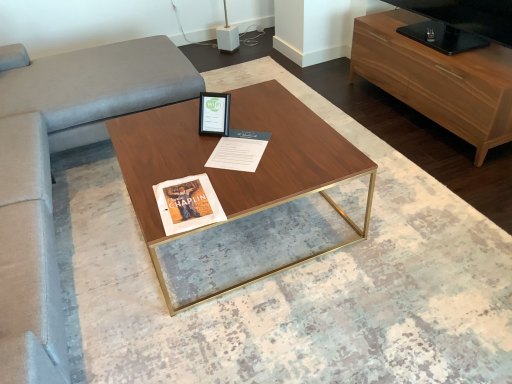
Where is `velvet couch at left`? This screenshot has height=384, width=512. velvet couch at left is located at coordinates (98, 87).

What do you see at coordinates (239, 150) in the screenshot?
I see `white paper at center` at bounding box center [239, 150].

The width and height of the screenshot is (512, 384). What do you see at coordinates (214, 114) in the screenshot?
I see `matte black picture frame at center` at bounding box center [214, 114].

What is the approximate width of matte black picture frame at center?

It is 4.31 inches.

Locate an element on the screen. The width and height of the screenshot is (512, 384). velvet couch at left is located at coordinates (98, 87).

From a real-world perspective, is velvet couch at left on white paper at center?

Indeed, from a real-world perspective, velvet couch at left stands above white paper at center.

Based on the photo, would you say velvet couch at left is outside white paper at center?

Yes, velvet couch at left is located beyond the bounds of white paper at center.

Does point (113, 50) appear closer or farther from the camera than point (232, 131)?

Point (113, 50).

Consider the image. Is velvet couch at left facing away from white paper at center?

No, velvet couch at left is not facing away from white paper at center.

Consider the image. Are velvet couch at left and matte black picture frame at center located far from each other?

No, velvet couch at left is not far from matte black picture frame at center.

Is velvet couch at left completely or partially outside of matte black picture frame at center?

Yes, velvet couch at left is outside of matte black picture frame at center.

Between velvet couch at left and matte black picture frame at center, which one is positioned in front?

velvet couch at left is closer to the camera.

I want to click on coffee table directly beneath the wooden cabinet at right (from a real-world perspective), so click(x=236, y=171).

Is wooden cabinet at right bigger or smaller than walnut wood coffee table at center?

In the image, wooden cabinet at right appears to be smaller than walnut wood coffee table at center.

Would you say wooden cabinet at right is a long distance from walnut wood coffee table at center?

wooden cabinet at right is far away from walnut wood coffee table at center.

Looking at their sizes, would you say wooden cabinet at right is wider or thinner than walnut wood coffee table at center?

wooden cabinet at right is thinner than walnut wood coffee table at center.

Based on the photo, considering the relative positions of wooden cabinet at right and matte black picture frame at center in the image provided, is wooden cabinet at right to the left or to the right of matte black picture frame at center?

In the image, wooden cabinet at right appears on the right side of matte black picture frame at center.

How different are the orientations of wooden cabinet at right and matte black picture frame at center in degrees?

wooden cabinet at right and matte black picture frame at center are facing 55 degrees away from each other.

Looking at their sizes, would you say wooden cabinet at right is wider or thinner than matte black picture frame at center?

Clearly, wooden cabinet at right has more width compared to matte black picture frame at center.

Considering the positions of objects wooden cabinet at right and matte black picture frame at center in the image provided, who is in front, wooden cabinet at right or matte black picture frame at center?

matte black picture frame at center.

Would you say white paper at center is a long distance from matte black picture frame at center?

They are positioned close to each other.

Is white paper at center inside the boundaries of matte black picture frame at center, or outside?

white paper at center is not enclosed by matte black picture frame at center.

Is white paper at center turned away from matte black picture frame at center?

No.

From the picture: Is matte black picture frame at center situated inside wooden cabinet at right or outside?

matte black picture frame at center is not enclosed by wooden cabinet at right.

Considering the sizes of objects matte black picture frame at center and wooden cabinet at right in the image provided, who is smaller, matte black picture frame at center or wooden cabinet at right?

matte black picture frame at center is smaller.

Considering the points (225, 97) and (492, 135), which point is behind, point (225, 97) or point (492, 135)?

The point (492, 135) is farther.

Where is `picture frame in front of the wooden cabinet at right`? The image size is (512, 384). picture frame in front of the wooden cabinet at right is located at coordinates (214, 114).

Which object is further away from the camera taking this photo, velvet couch at left or walnut wood coffee table at center?

Positioned behind is velvet couch at left.

Would you say velvet couch at left is a long distance from walnut wood coffee table at center?

velvet couch at left is actually quite close to walnut wood coffee table at center.

Which of these two, velvet couch at left or walnut wood coffee table at center, stands taller?

With more height is velvet couch at left.

You are a GUI agent. You are given a task and a screenshot of the screen. Output one action in this format:
    pyautogui.click(x=<x>, y=<y>)
    Task: Click on the gray positioned vertically above the white paper at center (from a real-world perspective)
    The height and width of the screenshot is (384, 512).
    Given the screenshot: What is the action you would take?
    pyautogui.click(x=98, y=87)

Locate an element on the screen. Image resolution: width=512 pixels, height=384 pixels. picture frame that is below the velvet couch at left (from the image's perspective) is located at coordinates (214, 114).

From the image, which object appears to be nearer to wooden cabinet at right, white paper at center or walnut wood coffee table at center?

walnut wood coffee table at center lies closer to wooden cabinet at right than the other object.

From the image, which object appears to be nearer to walnut wood coffee table at center, wooden cabinet at right or white paper at center?

The object closer to walnut wood coffee table at center is white paper at center.

Which object lies further to the anchor point wooden cabinet at right, velvet couch at left or matte black picture frame at center?

Based on the image, velvet couch at left appears to be further to wooden cabinet at right.

Which object lies further to the anchor point matte black picture frame at center, walnut wood coffee table at center or velvet couch at left?

Based on the image, velvet couch at left appears to be further to matte black picture frame at center.

Estimate the real-world distances between objects in this image. Which object is further from velvet couch at left, wooden cabinet at right or white paper at center?

wooden cabinet at right lies further to velvet couch at left than the other object.

Looking at the image, which one is located further to white paper at center, walnut wood coffee table at center or velvet couch at left?

Based on the image, velvet couch at left appears to be further to white paper at center.

Which object lies further to the anchor point wooden cabinet at right, matte black picture frame at center or velvet couch at left?

Based on the image, velvet couch at left appears to be further to wooden cabinet at right.

Based on their spatial positions, is white paper at center or walnut wood coffee table at center further from velvet couch at left?

Based on the image, white paper at center appears to be further to velvet couch at left.

Identify the location of magazine between velvet couch at left and wooden cabinet at right from left to right. (239, 150).

I want to click on coffee table between velvet couch at left and wooden cabinet at right in the horizontal direction, so click(x=236, y=171).

The width and height of the screenshot is (512, 384). I want to click on magazine between matte black picture frame at center and wooden cabinet at right from left to right, so click(239, 150).

The image size is (512, 384). Find the location of `picture frame between velvet couch at left and white paper at center in the horizontal direction`. picture frame between velvet couch at left and white paper at center in the horizontal direction is located at coordinates (214, 114).